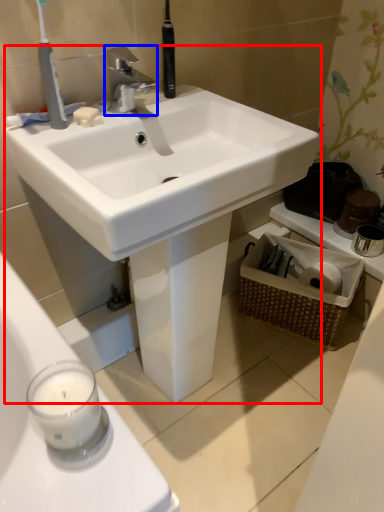
Question: Among these objects, which one is nearest to the camera, sink (highlighted by a red box) or tap (highlighted by a blue box)?

Choices:
 (A) sink
 (B) tap

Answer: (A)